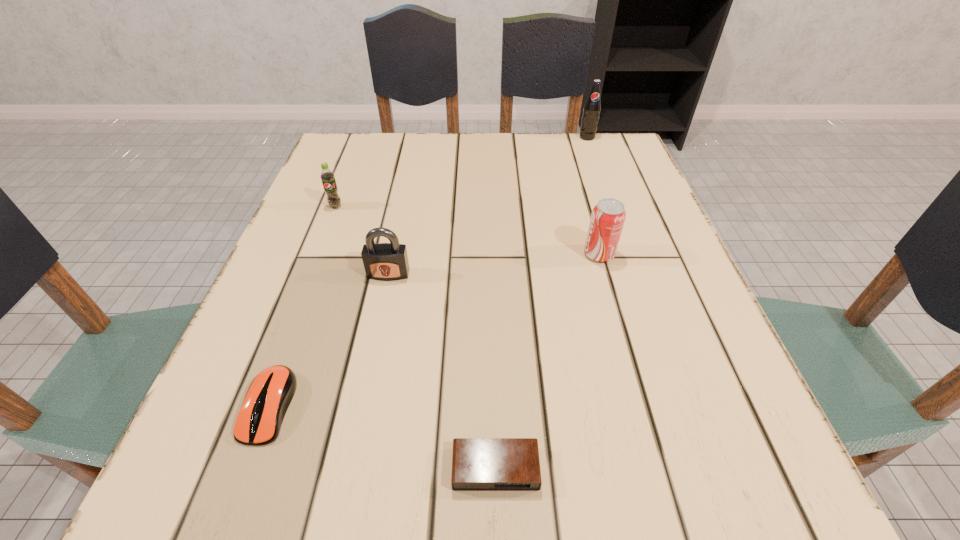
Identify which object is the third nearest to the farthest soda. Please provide its 2D coordinates. Your answer should be formatted as a tuple, i.e. [(x, y)], where the tuple contains the x and y coordinates of a point satisfying the conditions above.

[(327, 176)]

The height and width of the screenshot is (540, 960). What are the coordinates of `soda that is the nearest to the third farthest object` in the screenshot? It's located at (592, 107).

At what (x,y) coordinates should I click in order to perform the action: click on soda that is the second closest to the fourth object from right to left. Please return your answer as a coordinate pair (x, y). Looking at the image, I should click on (608, 216).

Identify the location of vacant point that satisfies the following two spatial constraints: 1. on the logo side of the fourth nearest object; 2. on the front face of the alarm clock. pyautogui.click(x=660, y=469).

The image size is (960, 540). What are the coordinates of `vacant space that satisfies the following two spatial constraints: 1. on the logo side of the third farthest object; 2. on the front of the fourth object from right to left near the keyhole` in the screenshot? It's located at (605, 274).

The image size is (960, 540). I want to click on vacant space that satisfies the following two spatial constraints: 1. on the logo side of the nearest soda; 2. on the front of the padlock near the keyhole, so click(605, 274).

Identify the location of free point that satisfies the following two spatial constraints: 1. on the front label of the computer mouse; 2. on the left side of the fifth nearest object. This screenshot has height=540, width=960. (258, 406).

Where is `vacant space that satisfies the following two spatial constraints: 1. on the logo side of the nearest soda; 2. on the front face of the fourth object from left to right`? The height and width of the screenshot is (540, 960). vacant space that satisfies the following two spatial constraints: 1. on the logo side of the nearest soda; 2. on the front face of the fourth object from left to right is located at coordinates (660, 469).

Where is `vacant space that satisfies the following two spatial constraints: 1. on the front label of the farthest soda; 2. on the logo side of the second soda from right to left`? vacant space that satisfies the following two spatial constraints: 1. on the front label of the farthest soda; 2. on the logo side of the second soda from right to left is located at coordinates (629, 254).